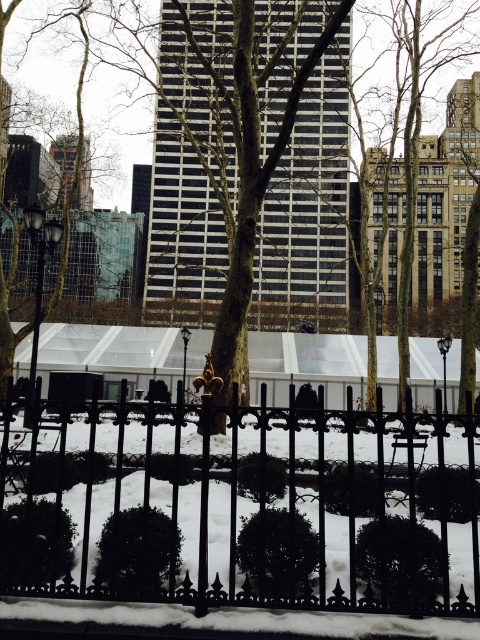
Does black wrought iron fence at lower center have a larger size compared to brown textured tree at center?

No, black wrought iron fence at lower center is not bigger than brown textured tree at center.

Find the location of `black wrought iron fence at lower center`. black wrought iron fence at lower center is located at coordinates (252, 516).